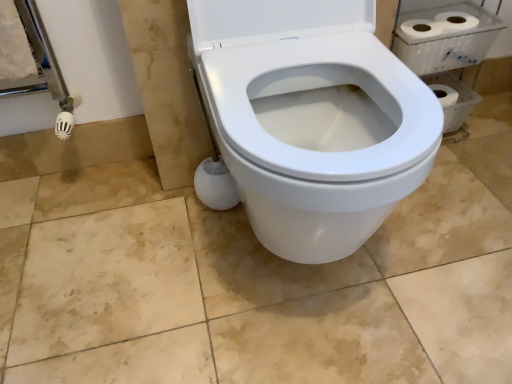
At what (x,y) coordinates should I click in order to perform the action: click on vacant space to the left of white glossy toilet at center. Please return your answer as a coordinate pair (x, y). The image size is (512, 384). Looking at the image, I should click on (129, 263).